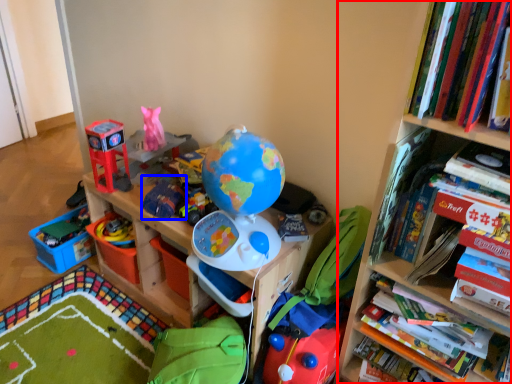
Question: Among these objects, which one is farthest to the camera, bookcase (highlighted by a red box) or toy (highlighted by a blue box)?

Choices:
 (A) bookcase
 (B) toy

Answer: (B)